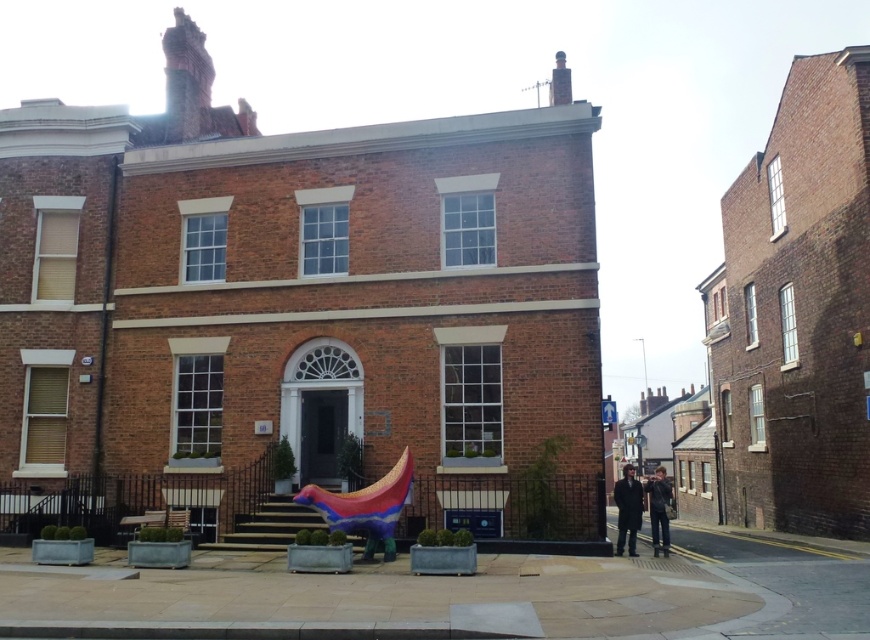
In the scene shown: Does dark brown leather coat at lower right have a lesser width compared to dark blue jeans at lower right?

Incorrect, dark brown leather coat at lower right's width is not less than dark blue jeans at lower right's.

Who is more forward, (638, 508) or (657, 552)?

Point (657, 552) is in front.

The width and height of the screenshot is (870, 640). What are the coordinates of `dark brown leather coat at lower right` in the screenshot? It's located at (627, 509).